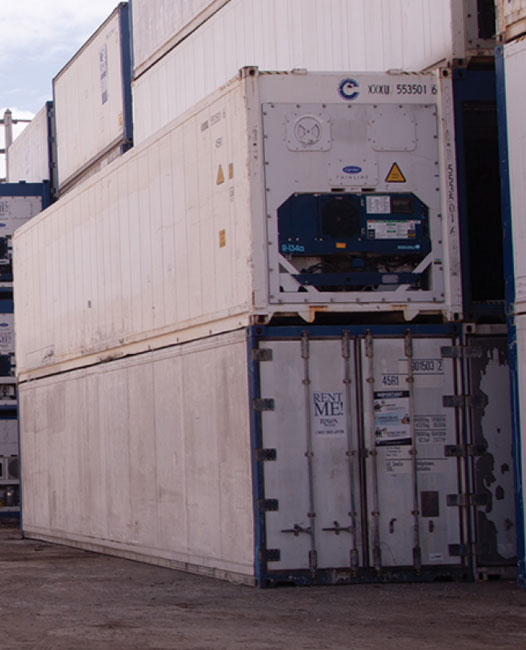
Where is `locks`? locks is located at coordinates (299, 528).